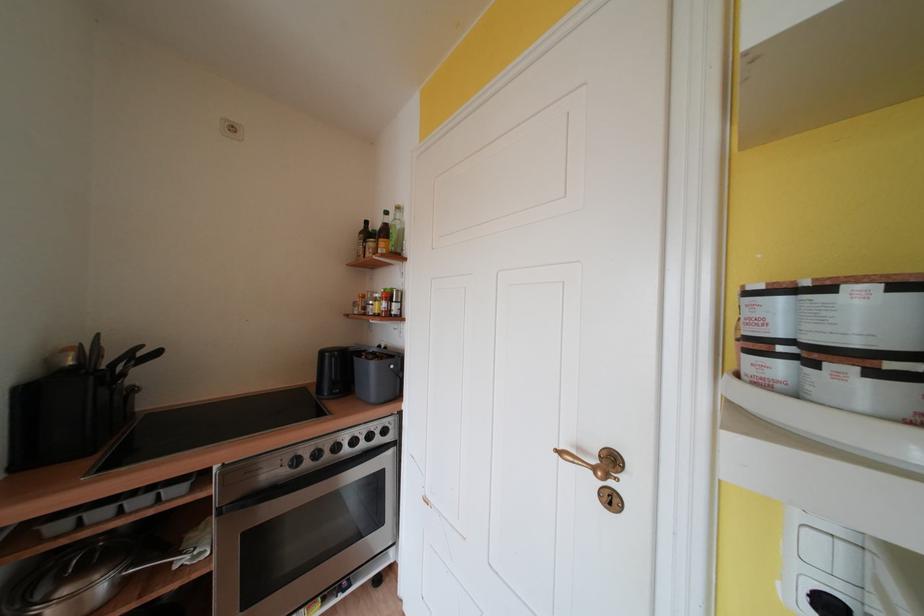
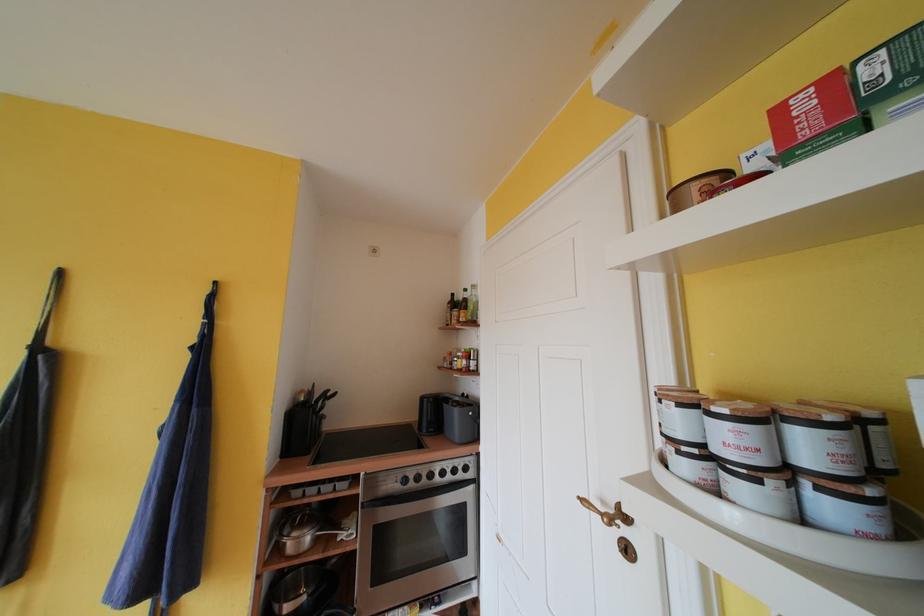
Find the pixel in the second image that matches [98,355] in the first image.

(315, 398)